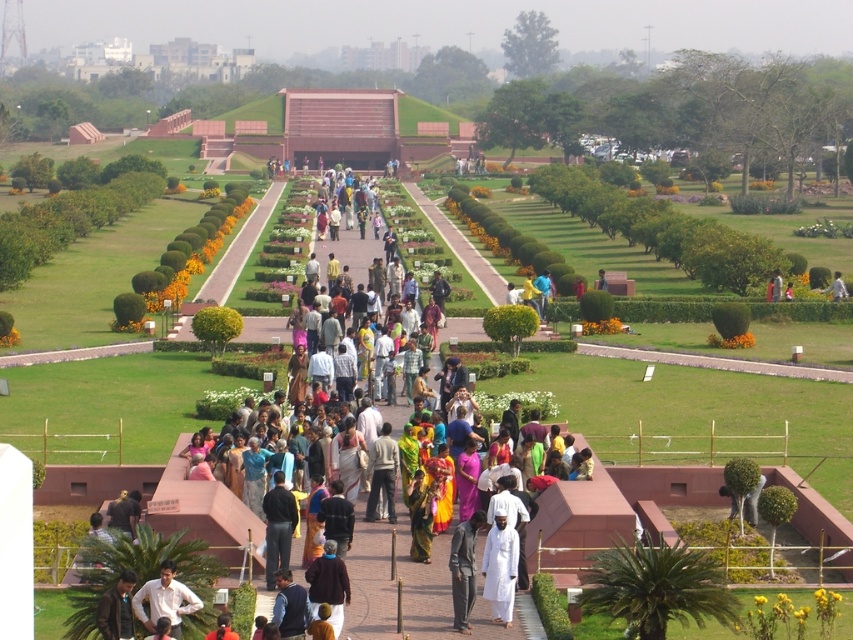
Question: Which object is farther from the camera taking this photo?

Choices:
 (A) dark gray fabric pants at center
 (B) light blue fabric at center

Answer: (B)

Question: Which is nearer to the dark blue jeans at center?

Choices:
 (A) dark brown leather jacket at lower left
 (B) light blue fabric at center

Answer: (A)

Question: Is dark blue jeans at center above light blue fabric at center?

Choices:
 (A) yes
 (B) no

Answer: (B)

Question: Considering the relative positions of dark gray fabric pants at center and dark brown leather jacket at lower left in the image provided, where is dark gray fabric pants at center located with respect to dark brown leather jacket at lower left?

Choices:
 (A) right
 (B) left

Answer: (A)

Question: Which object is farther from the camera taking this photo?

Choices:
 (A) light blue fabric at center
 (B) dark blue jeans at center
 (C) dark gray fabric pants at center

Answer: (A)

Question: Observing the image, what is the correct spatial positioning of white matte shirt at center in reference to dark gray fabric pants at center?

Choices:
 (A) left
 (B) right

Answer: (A)